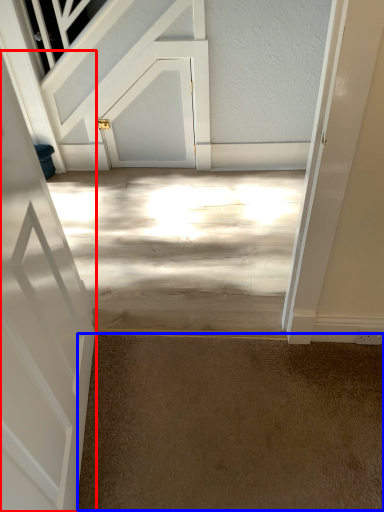
Question: Which object is closer to the camera taking this photo, door (highlighted by a red box) or concrete (highlighted by a blue box)?

Choices:
 (A) door
 (B) concrete

Answer: (A)